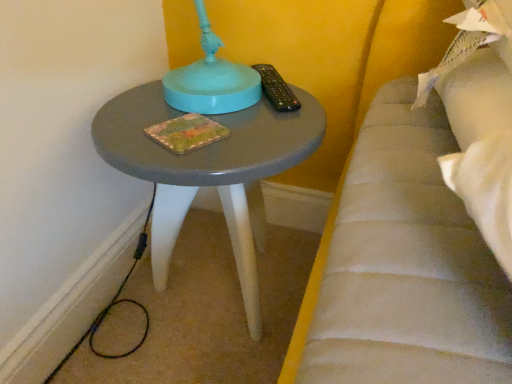
Question: In terms of width, does black plastic remote at upper right look wider or thinner when compared to matte gray table at center?

Choices:
 (A) thin
 (B) wide

Answer: (A)

Question: Is black plastic remote at upper right bigger or smaller than matte gray table at center?

Choices:
 (A) small
 (B) big

Answer: (A)

Question: Does point (282, 107) appear closer or farther from the camera than point (142, 89)?

Choices:
 (A) farther
 (B) closer

Answer: (B)

Question: Looking at the image, does matte gray table at center seem bigger or smaller compared to black plastic remote at upper right?

Choices:
 (A) small
 (B) big

Answer: (B)

Question: From the image's perspective, is matte gray table at center positioned above or below black plastic remote at upper right?

Choices:
 (A) above
 (B) below

Answer: (B)

Question: Is matte gray table at center to the left or to the right of black plastic remote at upper right in the image?

Choices:
 (A) right
 (B) left

Answer: (B)

Question: From their relative heights in the image, would you say matte gray table at center is taller or shorter than black plastic remote at upper right?

Choices:
 (A) tall
 (B) short

Answer: (A)